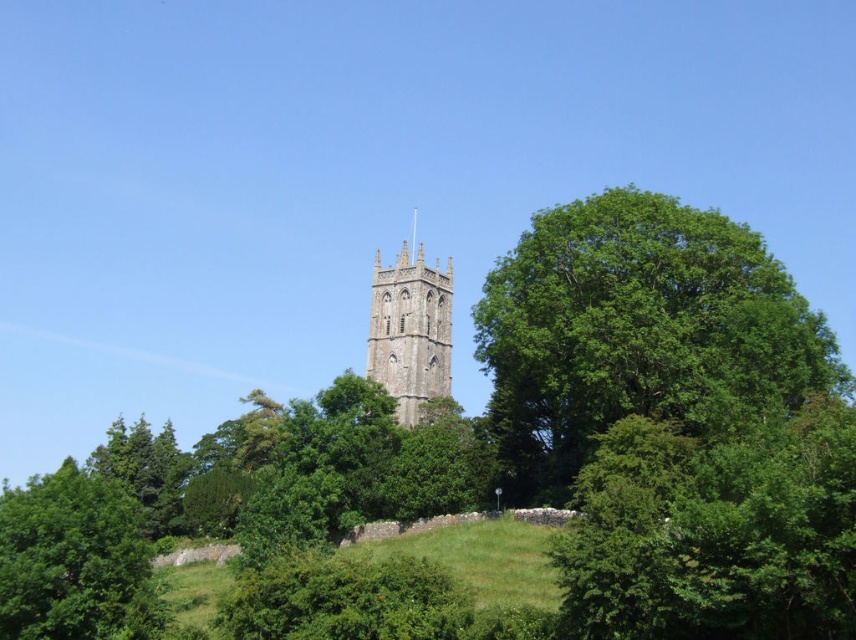
You are a photographer planning to capture the stone tower at center and the green leafy tree at lower left in a single shot. Based on their heights, which one will appear larger in the photo?

The stone tower at center is taller than the green leafy tree at lower left, so it will appear larger in the photo.

You are standing at the base of the historic stone tower and want to take a photo that includes both the green leafy tree at right and the green leafy tree at lower left. Which direction should you face to ensure both trees are in the frame?

You should face towards the center of the image so that both the green leafy tree at right and the green leafy tree at lower left are visible in the frame, as the green leafy tree at right is positioned to the right of the green leafy tree at lower left.